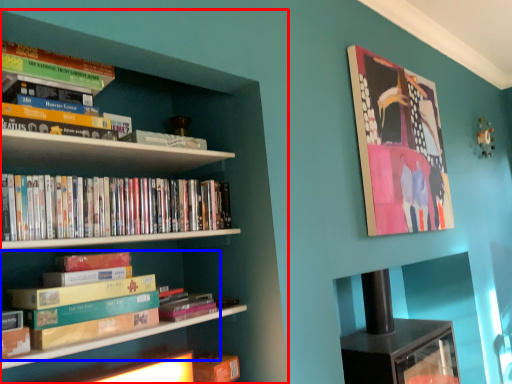
Question: Which point is further to the camera, bookcase (highlighted by a red box) or book (highlighted by a blue box)?

Choices:
 (A) bookcase
 (B) book

Answer: (B)